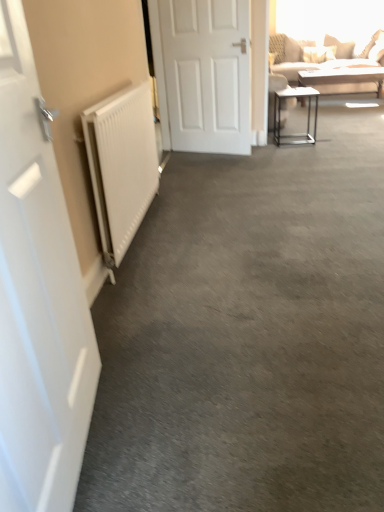
Question: Is metallic silver table at right, positioned as the first table in bottom-to-top order, aimed at white matte door at left, which appears as the 2th door when viewed from the top?

Choices:
 (A) yes
 (B) no

Answer: (B)

Question: Would you say white matte door at left, acting as the 1th door starting from the bottom, is part of metallic silver table at right, positioned as the first table in bottom-to-top order,'s contents?

Choices:
 (A) yes
 (B) no

Answer: (B)

Question: From a real-world perspective, is metallic silver table at right, which appears as the 2th table when viewed from the top, located beneath white matte door at left, the 2th door in the back-to-front sequence?

Choices:
 (A) yes
 (B) no

Answer: (A)

Question: Is metallic silver table at right, positioned as the 2th table in back-to-front order, located outside white matte door at left, the 2th door in the back-to-front sequence?

Choices:
 (A) no
 (B) yes

Answer: (B)

Question: Is metallic silver table at right, the 1th table viewed from the front, in contact with white matte door at left, arranged as the 1th door when viewed from the left?

Choices:
 (A) yes
 (B) no

Answer: (B)

Question: From the image's perspective, is metallic silver table at right, which appears as the 2th table when viewed from the top, above or below white matte radiator at left?

Choices:
 (A) above
 (B) below

Answer: (A)

Question: Based on their sizes in the image, would you say metallic silver table at right, the 1th table viewed from the front, is bigger or smaller than white matte radiator at left?

Choices:
 (A) big
 (B) small

Answer: (B)

Question: Choose the correct answer: Is metallic silver table at right, which ranks as the 2th table in right-to-left order, inside white matte radiator at left or outside it?

Choices:
 (A) outside
 (B) inside

Answer: (A)

Question: Does point (276, 144) appear closer or farther from the camera than point (105, 153)?

Choices:
 (A) farther
 (B) closer

Answer: (A)

Question: From a real-world perspective, relative to white matte door at center, which is the second door from front to back, is white matte radiator at left vertically above or below?

Choices:
 (A) above
 (B) below

Answer: (B)

Question: Considering the positions of point (142, 98) and point (183, 47), is point (142, 98) closer or farther from the camera than point (183, 47)?

Choices:
 (A) closer
 (B) farther

Answer: (A)

Question: From their relative heights in the image, would you say white matte radiator at left is taller or shorter than white matte door at center, the 2th door when ordered from bottom to top?

Choices:
 (A) tall
 (B) short

Answer: (B)

Question: Is white matte radiator at left inside the boundaries of white matte door at center, acting as the first door starting from the right, or outside?

Choices:
 (A) inside
 (B) outside

Answer: (B)

Question: In terms of height, does white matte radiator at left look taller or shorter compared to metallic silver table at right, positioned as the 2th table in back-to-front order?

Choices:
 (A) tall
 (B) short

Answer: (A)

Question: Is white matte radiator at left bigger or smaller than metallic silver table at right, which ranks as the 2th table in right-to-left order?

Choices:
 (A) big
 (B) small

Answer: (A)